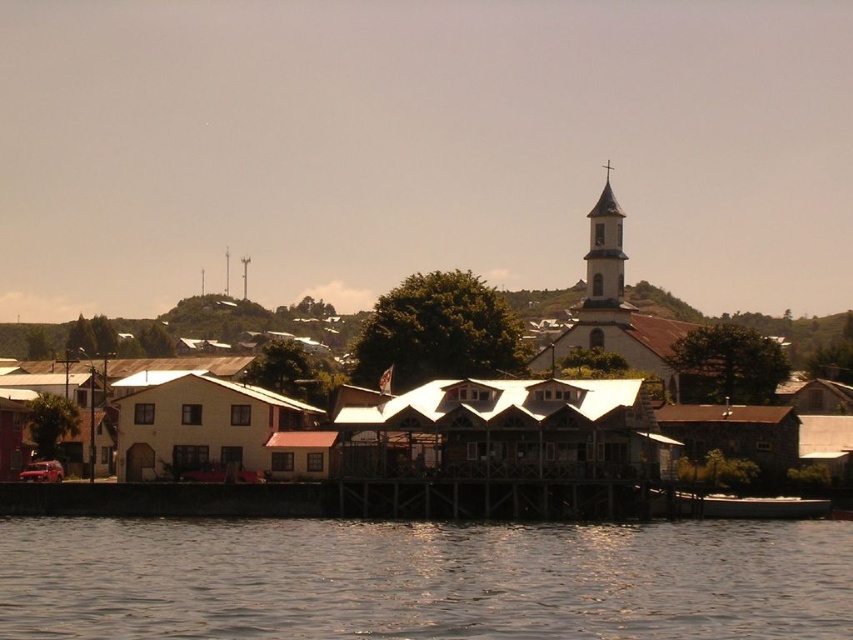
You are a tourist visiting this coastal town and want to take a photo that includes both the yellow wooden houses at center and the brushed metal spire at upper center. Which object should you position closer to the camera to ensure both are in focus?

Since the yellow wooden houses at center are bigger than the brushed metal spire at upper center, you should position the yellow wooden houses at center closer to the camera to ensure both are in focus.

You are a photographer trying to capture the brown wooden dock at center and the metallic spire at upper center in a single shot. Based on their sizes in the image, which object would appear bigger in your photo?

The brown wooden dock at center appears bigger in the photo because it has a larger size compared to the metallic spire at upper center.

You are a tourist standing at the edge of the water in this coastal town. You want to take a photo that includes both the yellow wooden houses at center and the white stucco bell tower at upper center. Given their distance apart, can you frame both in a single shot without moving your position? Explain your reasoning.

The yellow wooden houses at center and the white stucco bell tower at upper center are 35.45 meters apart. Since the distance between them is significant, you might need a wide angle lens to capture both in a single frame without moving your position.